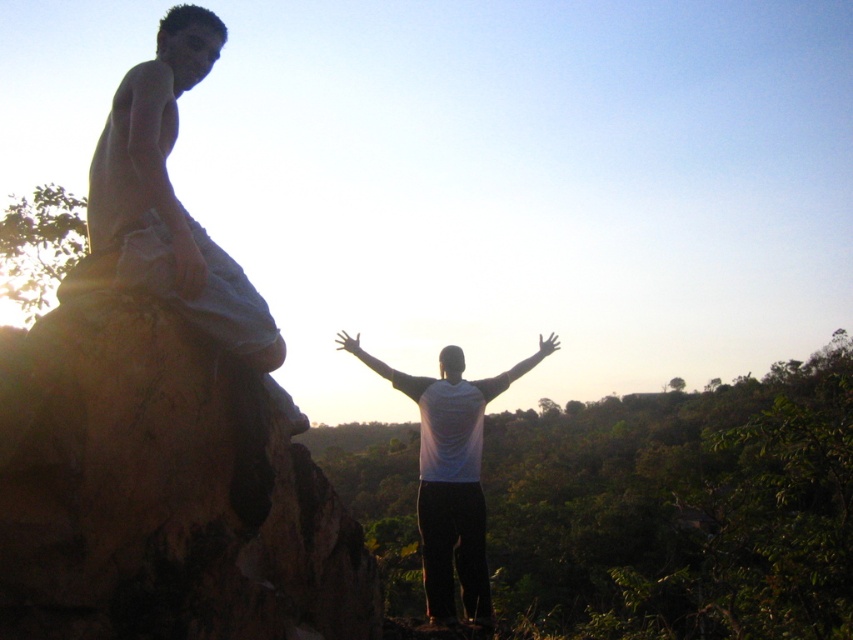
You are a photographer trying to capture a closeup of the matte gray shorts at upper left and the white matte hand at center. Which object should you zoom in on more to ensure both fit in the frame?

You should zoom in more on the white matte hand at center because it is smaller than the matte gray shorts at upper left, so it requires more focus to capture details while keeping both in frame.

You are a photographer trying to capture both the white matte shirt at center and the matte white hand at upper left in a single shot. Based on their sizes in the image, which object should you focus on first to ensure both are in frame?

The white matte shirt at center is taller than the matte white hand at upper left, so you should focus on the white matte shirt at center first to ensure both are in frame.